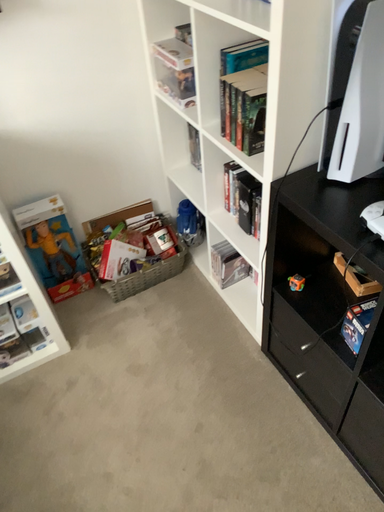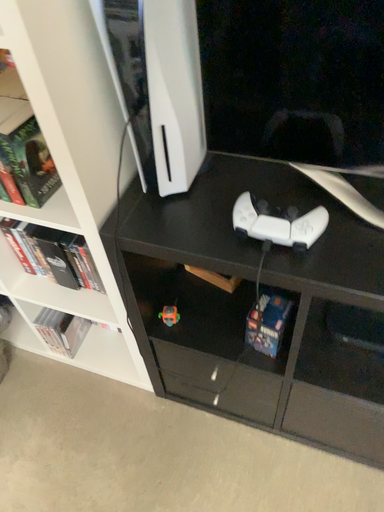
Question: How did the camera likely rotate when shooting the video?

Choices:
 (A) rotated right
 (B) rotated left

Answer: (A)